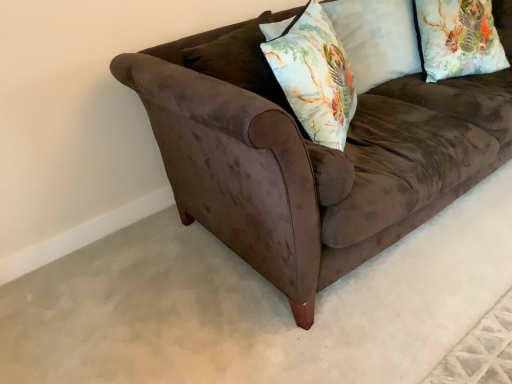
Where is `floral fabric pillow at upper right, the 2th pillow when ordered from left to right`? The width and height of the screenshot is (512, 384). floral fabric pillow at upper right, the 2th pillow when ordered from left to right is located at coordinates (458, 38).

Identify the location of floral fabric pillow at center. The image size is (512, 384). (314, 76).

What is the approximate width of floral fabric pillow at upper right, arranged as the 2th pillow when viewed from the right?

10.77 inches.

Identify the location of floral fabric pillow at upper right, placed as the 1th pillow when sorted from right to left. This screenshot has height=384, width=512. (458, 38).

Could you tell me if floral fabric pillow at center is facing floral fabric pillow at upper right, arranged as the 2th pillow when viewed from the right?

No, floral fabric pillow at center is not oriented towards floral fabric pillow at upper right, arranged as the 2th pillow when viewed from the right.

Does floral fabric pillow at center have a lesser width compared to floral fabric pillow at upper right, arranged as the 2th pillow when viewed from the right?

Yes.

From the picture: From a real-world perspective, which object rests below the other?

From a 3D spatial view, floral fabric pillow at upper right, which is the 1th pillow in left-to-right order, is below.

Is floral fabric pillow at upper right, the 2th pillow when ordered from left to right, bigger than brown velvet couch at center?

No.

At what (x,y) coordinates should I click in order to perform the action: click on pillow on the right of the brown velvet couch at center. Please return your answer as a coordinate pair (x, y). Image resolution: width=512 pixels, height=384 pixels. Looking at the image, I should click on (458, 38).

Does floral fabric pillow at upper right, the 2th pillow when ordered from left to right, have a greater width compared to brown velvet couch at center?

In fact, floral fabric pillow at upper right, the 2th pillow when ordered from left to right, might be narrower than brown velvet couch at center.

Is brown velvet couch at center at the back of floral fabric pillow at upper right, placed as the 1th pillow when sorted from right to left?

Absolutely, floral fabric pillow at upper right, placed as the 1th pillow when sorted from right to left, is directed away from brown velvet couch at center.

Based on their sizes in the image, would you say brown velvet couch at center is bigger or smaller than floral fabric pillow at upper right, which is the 1th pillow in left-to-right order?

brown velvet couch at center is bigger than floral fabric pillow at upper right, which is the 1th pillow in left-to-right order.

From the brown velvet couch at center, count 2nd pillows backward and point to it. Please provide its 2D coordinates.

[(376, 39)]

From a real-world perspective, is brown velvet couch at center positioned above or below floral fabric pillow at upper right, which is the 1th pillow in left-to-right order?

brown velvet couch at center is situated lower than floral fabric pillow at upper right, which is the 1th pillow in left-to-right order, in the real world.

Is brown velvet couch at center positioned far away from floral fabric pillow at upper right, arranged as the 2th pillow when viewed from the right?

No, brown velvet couch at center is in close proximity to floral fabric pillow at upper right, arranged as the 2th pillow when viewed from the right.

Does brown velvet couch at center have a greater height compared to floral fabric pillow at upper right, placed as the 1th pillow when sorted from right to left?

Indeed, brown velvet couch at center has a greater height compared to floral fabric pillow at upper right, placed as the 1th pillow when sorted from right to left.

How different are the orientations of brown velvet couch at center and floral fabric pillow at upper right, the 2th pillow when ordered from left to right, in degrees?

The angular difference between brown velvet couch at center and floral fabric pillow at upper right, the 2th pillow when ordered from left to right, is 16.1 degrees.

Considering the sizes of objects brown velvet couch at center and floral fabric pillow at upper right, placed as the 1th pillow when sorted from right to left, in the image provided, who is smaller, brown velvet couch at center or floral fabric pillow at upper right, placed as the 1th pillow when sorted from right to left,?

floral fabric pillow at upper right, placed as the 1th pillow when sorted from right to left.

Considering the relative sizes of floral fabric pillow at upper right, arranged as the 2th pillow when viewed from the right, and floral fabric pillow at upper right, placed as the 1th pillow when sorted from right to left, in the image provided, is floral fabric pillow at upper right, arranged as the 2th pillow when viewed from the right, shorter than floral fabric pillow at upper right, placed as the 1th pillow when sorted from right to left,?

No.

From a real-world perspective, which is physically above, floral fabric pillow at upper right, arranged as the 2th pillow when viewed from the right, or floral fabric pillow at upper right, the 2th pillow when ordered from left to right?

In real-world perspective, floral fabric pillow at upper right, arranged as the 2th pillow when viewed from the right, is above.

Is floral fabric pillow at upper right, which is the 1th pillow in left-to-right order, not close to floral fabric pillow at upper right, placed as the 1th pillow when sorted from right to left?

No, floral fabric pillow at upper right, which is the 1th pillow in left-to-right order, is in close proximity to floral fabric pillow at upper right, placed as the 1th pillow when sorted from right to left.

Is floral fabric pillow at upper right, which is the 1th pillow in left-to-right order, oriented towards floral fabric pillow at upper right, the 2th pillow when ordered from left to right?

No, floral fabric pillow at upper right, which is the 1th pillow in left-to-right order, is not aimed at floral fabric pillow at upper right, the 2th pillow when ordered from left to right.

Is floral fabric pillow at upper right, placed as the 1th pillow when sorted from right to left, wider or thinner than floral fabric pillow at center?

floral fabric pillow at upper right, placed as the 1th pillow when sorted from right to left, is wider than floral fabric pillow at center.

Is floral fabric pillow at upper right, the 2th pillow when ordered from left to right, touching floral fabric pillow at center?

floral fabric pillow at upper right, the 2th pillow when ordered from left to right, is not next to floral fabric pillow at center, and they're not touching.

Which point is more forward, (421, 30) or (265, 55)?

The point (265, 55) is closer.

In terms of height, does floral fabric pillow at upper right, the 2th pillow when ordered from left to right, look taller or shorter compared to floral fabric pillow at center?

In the image, floral fabric pillow at upper right, the 2th pillow when ordered from left to right, appears to be shorter than floral fabric pillow at center.

Does point (398, 100) appear closer or farther from the camera than point (283, 87)?

Point (398, 100).

Who is smaller, brown velvet couch at center or floral fabric pillow at center?

floral fabric pillow at center.

From the image's perspective, is brown velvet couch at center above floral fabric pillow at center?

Indeed, from the image's perspective, brown velvet couch at center is shown above floral fabric pillow at center.

From a real-world perspective, starting from the floral fabric pillow at center, which pillow is the 1st one below it? Please provide its 2D coordinates.

[(376, 39)]

This screenshot has height=384, width=512. I want to click on studio couch lying below the floral fabric pillow at upper right, the 2th pillow when ordered from left to right (from the image's perspective), so click(312, 158).

Estimate the real-world distances between objects in this image. Which object is further from floral fabric pillow at upper right, placed as the 1th pillow when sorted from right to left, brown velvet couch at center or floral fabric pillow at upper right, arranged as the 2th pillow when viewed from the right?

brown velvet couch at center is further to floral fabric pillow at upper right, placed as the 1th pillow when sorted from right to left.

Consider the image. From the image, which object appears to be farther from brown velvet couch at center, floral fabric pillow at center or floral fabric pillow at upper right, placed as the 1th pillow when sorted from right to left?

Based on the image, floral fabric pillow at upper right, placed as the 1th pillow when sorted from right to left, appears to be further to brown velvet couch at center.

In the scene shown: Considering their positions, is floral fabric pillow at upper right, placed as the 1th pillow when sorted from right to left, positioned further to floral fabric pillow at center than brown velvet couch at center?

floral fabric pillow at upper right, placed as the 1th pillow when sorted from right to left, lies further to floral fabric pillow at center than the other object.

Estimate the real-world distances between objects in this image. Which object is closer to floral fabric pillow at center, brown velvet couch at center or floral fabric pillow at upper right, placed as the 1th pillow when sorted from right to left?

brown velvet couch at center.

Which object lies nearer to the anchor point floral fabric pillow at upper right, placed as the 1th pillow when sorted from right to left, floral fabric pillow at upper right, arranged as the 2th pillow when viewed from the right, or floral fabric pillow at center?

Based on the image, floral fabric pillow at upper right, arranged as the 2th pillow when viewed from the right, appears to be nearer to floral fabric pillow at upper right, placed as the 1th pillow when sorted from right to left.

Considering their positions, is floral fabric pillow at upper right, placed as the 1th pillow when sorted from right to left, positioned closer to brown velvet couch at center than floral fabric pillow at upper right, which is the 1th pillow in left-to-right order?

The object closer to brown velvet couch at center is floral fabric pillow at upper right, placed as the 1th pillow when sorted from right to left.

Estimate the real-world distances between objects in this image. Which object is further from floral fabric pillow at upper right, arranged as the 2th pillow when viewed from the right, brown velvet couch at center or floral fabric pillow at center?

Among the two, brown velvet couch at center is located further to floral fabric pillow at upper right, arranged as the 2th pillow when viewed from the right.

Looking at the image, which one is located further to floral fabric pillow at upper right, which is the 1th pillow in left-to-right order, floral fabric pillow at upper right, the 2th pillow when ordered from left to right, or brown velvet couch at center?

Among the two, brown velvet couch at center is located further to floral fabric pillow at upper right, which is the 1th pillow in left-to-right order.

I want to click on pillow between floral fabric pillow at center and floral fabric pillow at upper right, placed as the 1th pillow when sorted from right to left, so click(376, 39).

At what (x,y) coordinates should I click in order to perform the action: click on throw pillow located between brown velvet couch at center and floral fabric pillow at upper right, the 2th pillow when ordered from left to right, in the depth direction. Please return your answer as a coordinate pair (x, y). Looking at the image, I should click on (314, 76).

This screenshot has height=384, width=512. What are the coordinates of `pillow located between brown velvet couch at center and floral fabric pillow at upper right, arranged as the 2th pillow when viewed from the right, in the depth direction` in the screenshot? It's located at (458, 38).

Identify the location of throw pillow positioned between brown velvet couch at center and floral fabric pillow at upper right, arranged as the 2th pillow when viewed from the right, from near to far. This screenshot has width=512, height=384. (314, 76).